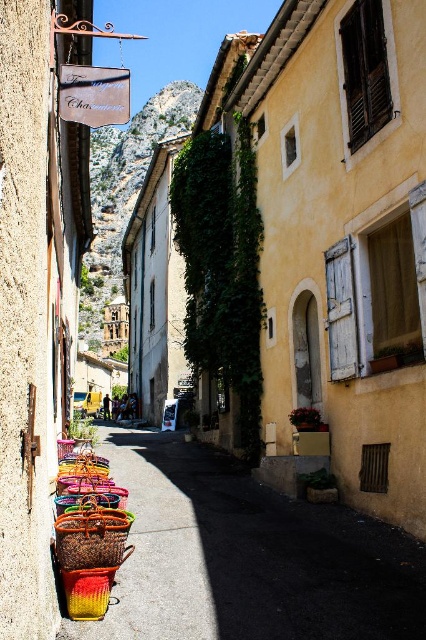
Question: Considering the relative positions of smooth concrete pavement at center and bright yellow woven basket at center in the image provided, where is smooth concrete pavement at center located with respect to bright yellow woven basket at center?

Choices:
 (A) left
 (B) right

Answer: (B)

Question: Which point is farther from the camera taking this photo?

Choices:
 (A) (77, 86)
 (B) (120, 563)

Answer: (A)

Question: Can you confirm if smooth concrete pavement at center is positioned above bright yellow woven basket at center?

Choices:
 (A) yes
 (B) no

Answer: (B)

Question: Which point is farther from the camera taking this photo?

Choices:
 (A) (121, 545)
 (B) (207, 541)
 (C) (106, 77)

Answer: (C)

Question: Which of the following is the closest to the observer?

Choices:
 (A) wooden signboard at upper left
 (B) smooth concrete pavement at center

Answer: (B)

Question: Is bright yellow woven basket at center wider than wooden signboard at upper left?

Choices:
 (A) no
 (B) yes

Answer: (B)